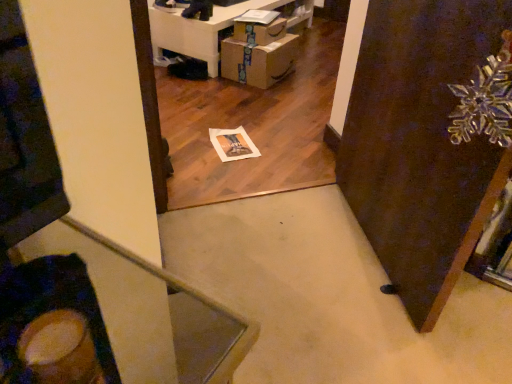
You are a GUI agent. You are given a task and a screenshot of the screen. Output one action in this format:
    pyautogui.click(x=<x>, y=<y>)
    Task: Click on the free point to the left of transparent glass snowflake at upper right
    The height and width of the screenshot is (384, 512).
    Given the screenshot: What is the action you would take?
    pyautogui.click(x=287, y=241)